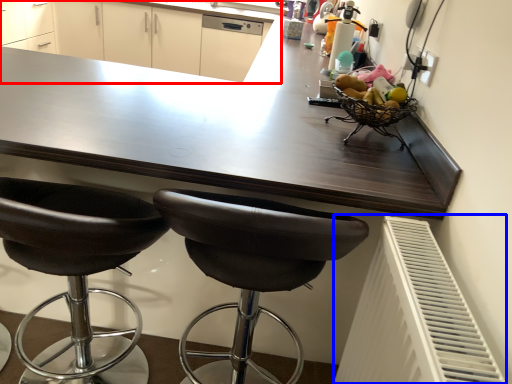
Question: Among these objects, which one is nearest to the camera, cabinetry (highlighted by a red box) or radiator (highlighted by a blue box)?

Choices:
 (A) cabinetry
 (B) radiator

Answer: (B)